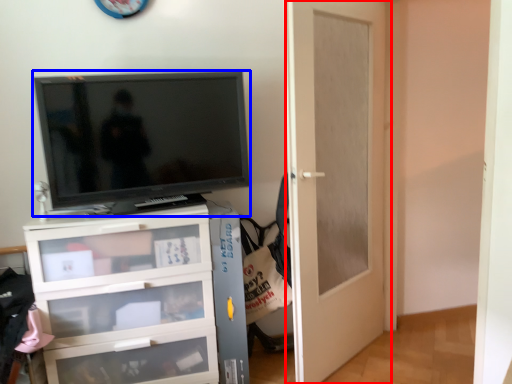
Question: Which point is closer to the camera, door (highlighted by a red box) or television (highlighted by a blue box)?

Choices:
 (A) door
 (B) television

Answer: (A)